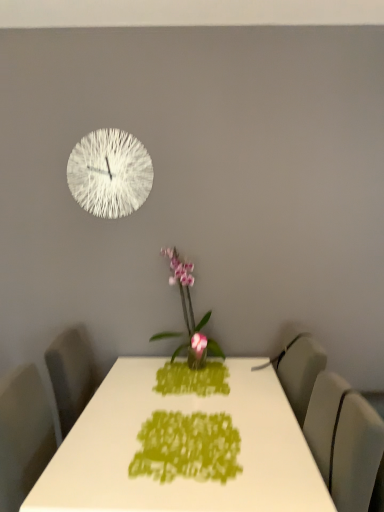
This screenshot has height=512, width=384. Find the location of `vacant area on the back side of green fabric placemat at center`. vacant area on the back side of green fabric placemat at center is located at coordinates (204, 398).